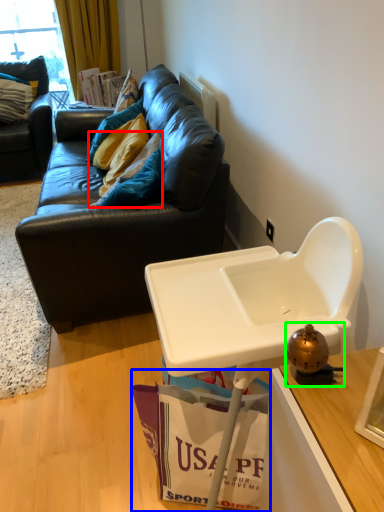
Question: Which object is the farthest from pillow (highlighted by a red box)? Choose among these: shopping bag (highlighted by a blue box) or toy (highlighted by a green box).

Choices:
 (A) shopping bag
 (B) toy

Answer: (B)